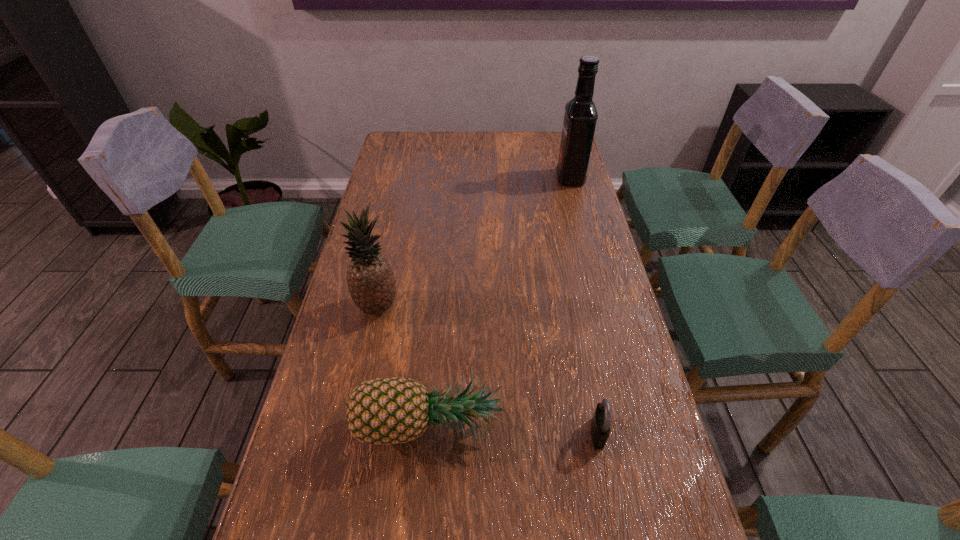
Identify which object is located as the second nearest to the padlock. Please provide its 2D coordinates. Your answer should be formatted as a tuple, i.e. [(x, y)], where the tuple contains the x and y coordinates of a point satisfying the conditions above.

[(370, 279)]

This screenshot has height=540, width=960. I want to click on vacant area that satisfies the following two spatial constraints: 1. on the front-facing side of the farthest object; 2. on the front side of the nearer pineapple, so click(x=636, y=424).

Locate an element on the screen. The width and height of the screenshot is (960, 540). free location that satisfies the following two spatial constraints: 1. on the front-facing side of the farthest object; 2. on the front side of the third tallest object is located at coordinates (636, 424).